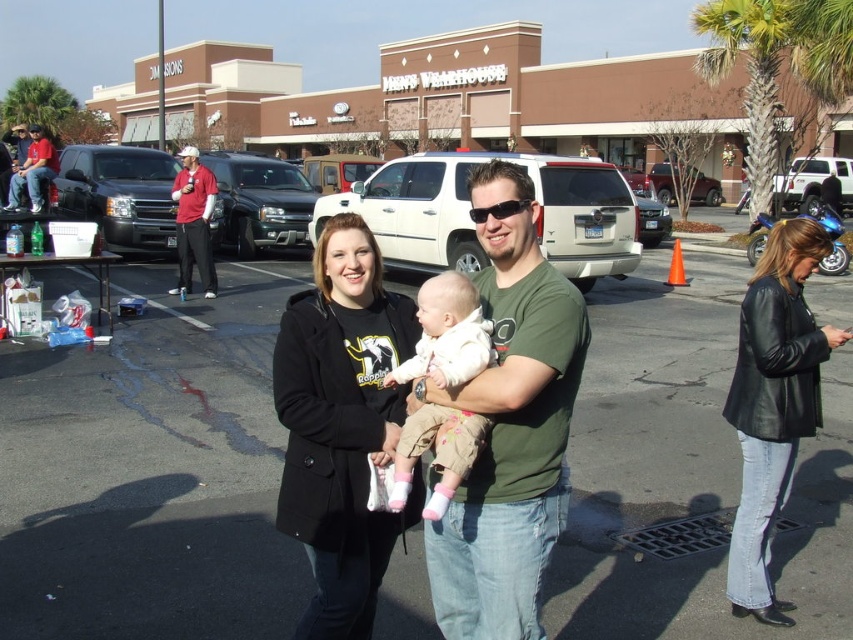
You are planning to install a new parking lot divider in the center of the image. The divider is 2 meters wide. Given the scene described, will the divider fit within the black asphalt parking lot at center without overlapping the black leather jacket at lower right?

The black asphalt parking lot at center is wider than the black leather jacket at lower right, so the 2 meter wide divider should fit within the parking lot without overlapping the jacket.

You are standing at the edge of the parking lot and want to walk to the black leather jacket at lower right. Which direction should you head relative to the black asphalt parking lot at center?

To reach the black leather jacket at lower right, you should head to the right of the black asphalt parking lot at center since the jacket is located to its right side.

You are a photographer setting up a shot of the black leather jacket at lower right and the matte black truck at left. The camera can only capture objects wider than 1.2 meters. Can both objects fit within the camera frame if they are placed side by side?

The black leather jacket at lower right is narrower than the matte black truck at left. However, since the exact widths aren